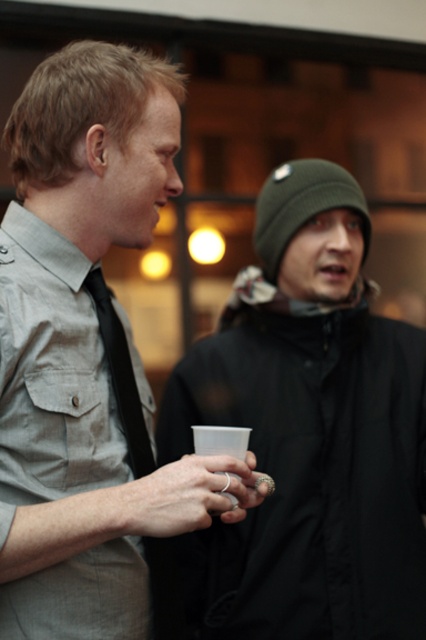
How distant is matte gray shirt at center from black matte tie at left?

The distance of matte gray shirt at center from black matte tie at left is 4.99 inches.

Who is more forward, (60,216) or (135,433)?

Point (60,216) is more forward.

This screenshot has height=640, width=426. What do you see at coordinates (88, 353) in the screenshot? I see `matte gray shirt at center` at bounding box center [88, 353].

Identify the location of matte gray shirt at center. (88, 353).

From the picture: Can you confirm if matte gray shirt at center is positioned to the right of dark green knit hat at upper right?

No, matte gray shirt at center is not to the right of dark green knit hat at upper right.

Describe the element at coordinates (88, 353) in the screenshot. I see `matte gray shirt at center` at that location.

Is point (72, 209) positioned behind point (307, 467)?

No, (72, 209) is in front of (307, 467).

At what (x,y) coordinates should I click in order to perform the action: click on matte gray shirt at center. Please return your answer as a coordinate pair (x, y). This screenshot has width=426, height=640. Looking at the image, I should click on (88, 353).

Which is in front, point (313, 337) or point (118, 396)?

Positioned in front is point (118, 396).

Can you confirm if dark green knit hat at upper right is positioned above black matte tie at left?

Incorrect, dark green knit hat at upper right is not positioned above black matte tie at left.

Is point (190, 376) positioned after point (127, 384)?

Yes, it is behind point (127, 384).

Identify the location of dark green knit hat at upper right. (308, 433).